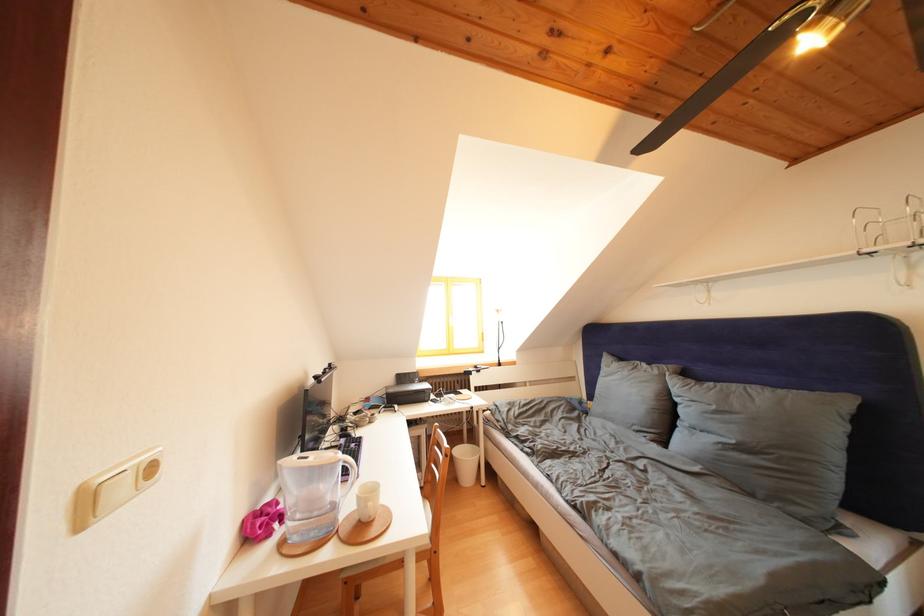
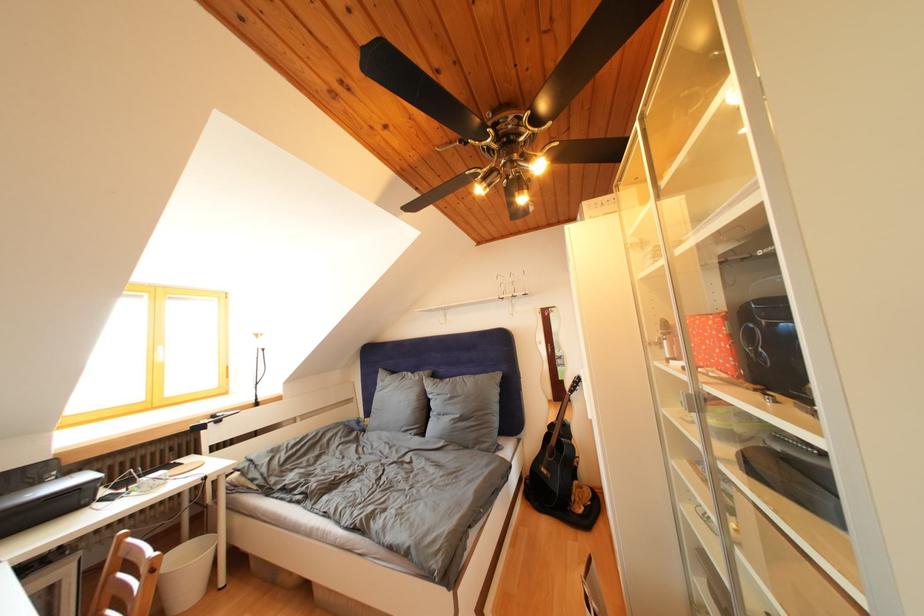
Question: The camera is either moving clockwise (left) or counter-clockwise (right) around the object. The first image is from the beginning of the video and the second image is from the end. Is the camera moving left or right when shooting the video?

Choices:
 (A) Left
 (B) Right

Answer: (A)